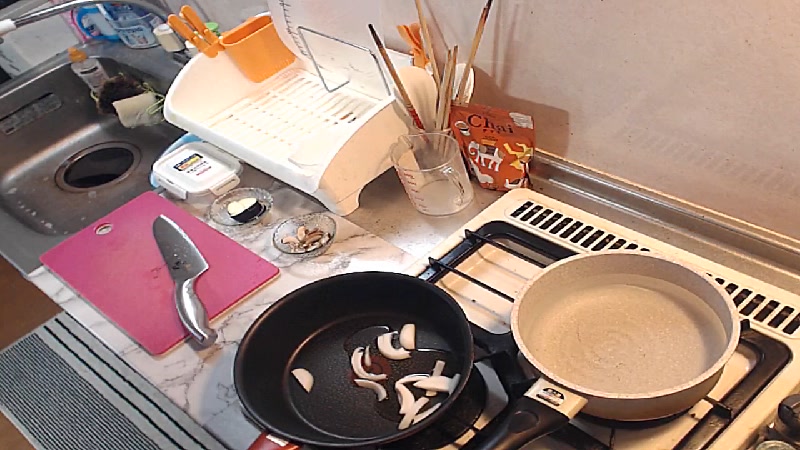
You are a GUI agent. You are given a task and a screenshot of the screen. Output one action in this format:
    pyautogui.click(x=<x>, y=<y>)
    Task: Click on the wall
    
    Given the screenshot: What is the action you would take?
    pyautogui.click(x=706, y=91)